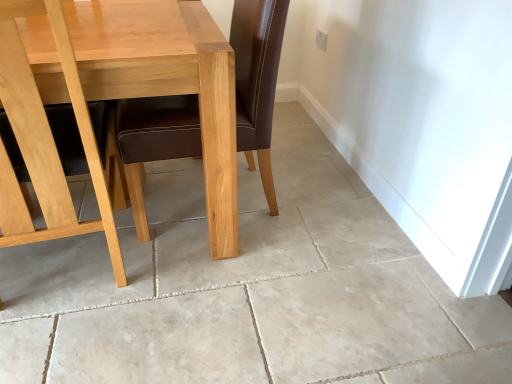
Question: Is light brown wood chair at left in contact with light brown wood table at center?

Choices:
 (A) yes
 (B) no

Answer: (B)

Question: Is light brown wood chair at left at the left side of light brown wood table at center?

Choices:
 (A) no
 (B) yes

Answer: (B)

Question: Can you confirm if light brown wood chair at left is positioned to the right of light brown wood table at center?

Choices:
 (A) no
 (B) yes

Answer: (A)

Question: Can you confirm if light brown wood chair at left is thinner than light brown wood table at center?

Choices:
 (A) no
 (B) yes

Answer: (B)

Question: Considering the relative positions of light brown wood chair at left and light brown wood table at center in the image provided, is light brown wood chair at left in front of light brown wood table at center?

Choices:
 (A) yes
 (B) no

Answer: (A)

Question: Looking at their shapes, would you say beige tile floor at center is wider or thinner than light brown wood chair at left?

Choices:
 (A) thin
 (B) wide

Answer: (B)

Question: In the image, is beige tile floor at center positioned in front of or behind light brown wood chair at left?

Choices:
 (A) front
 (B) behind

Answer: (B)

Question: Is point (246, 372) positioned closer to the camera than point (109, 183)?

Choices:
 (A) farther
 (B) closer

Answer: (B)

Question: From the image's perspective, is beige tile floor at center above or below light brown wood chair at left?

Choices:
 (A) above
 (B) below

Answer: (B)

Question: In the image, is light brown wood chair at left on the left side or the right side of light brown wood table at center?

Choices:
 (A) left
 (B) right

Answer: (A)

Question: Is light brown wood chair at left in front of or behind light brown wood table at center in the image?

Choices:
 (A) behind
 (B) front

Answer: (B)

Question: In terms of width, does light brown wood chair at left look wider or thinner when compared to light brown wood table at center?

Choices:
 (A) wide
 (B) thin

Answer: (B)

Question: Looking at the image, does light brown wood chair at left seem bigger or smaller compared to light brown wood table at center?

Choices:
 (A) big
 (B) small

Answer: (B)

Question: In terms of height, does light brown wood table at center look taller or shorter compared to light brown wood chair at left?

Choices:
 (A) tall
 (B) short

Answer: (B)

Question: Do you think light brown wood table at center is within light brown wood chair at left, or outside of it?

Choices:
 (A) inside
 (B) outside

Answer: (B)